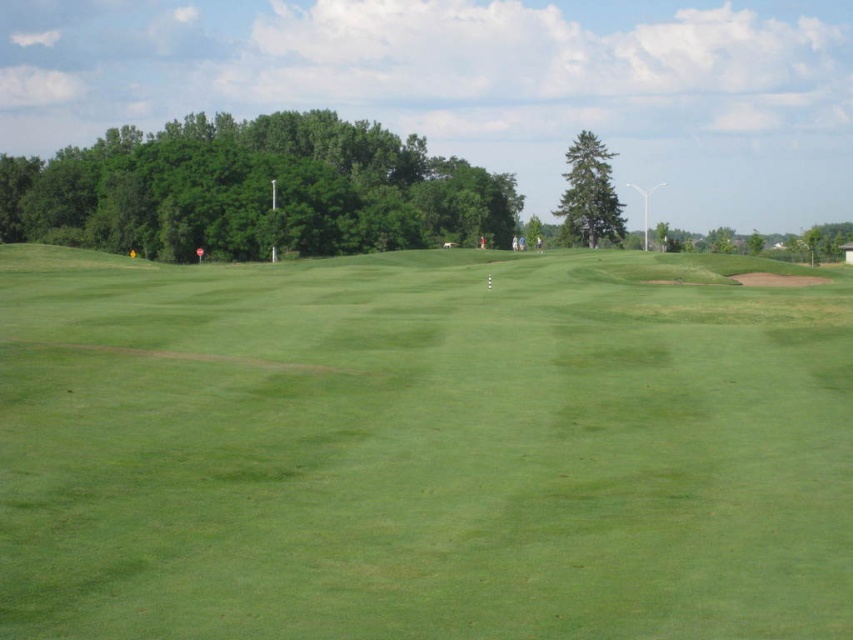
Question: Which of the following is the closest to the observer?

Choices:
 (A) green leafy tree at upper left
 (B) green grassy field at center
 (C) green textured tree at center

Answer: (B)

Question: Is green grassy field at center to the right of green leafy tree at upper left from the viewer's perspective?

Choices:
 (A) no
 (B) yes

Answer: (B)

Question: Which point is closer to the camera taking this photo?

Choices:
 (A) (426, 236)
 (B) (585, 188)

Answer: (B)

Question: Is green leafy tree at upper left positioned before green textured tree at center?

Choices:
 (A) no
 (B) yes

Answer: (B)

Question: Estimate the real-world distances between objects in this image. Which object is farther from the green leafy tree at upper left?

Choices:
 (A) green textured tree at center
 (B) green grassy field at center

Answer: (B)

Question: Does green leafy tree at upper left appear on the right side of green textured tree at center?

Choices:
 (A) yes
 (B) no

Answer: (B)